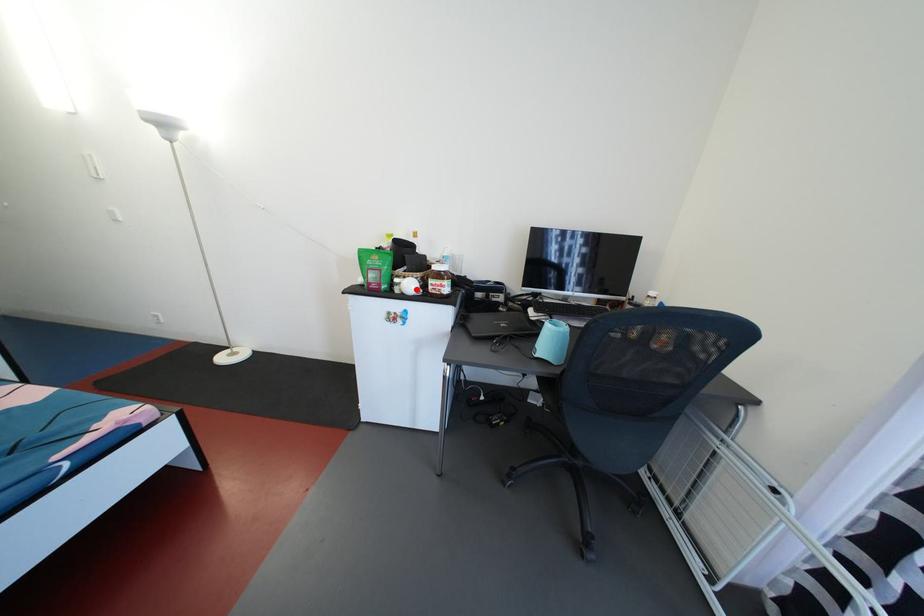
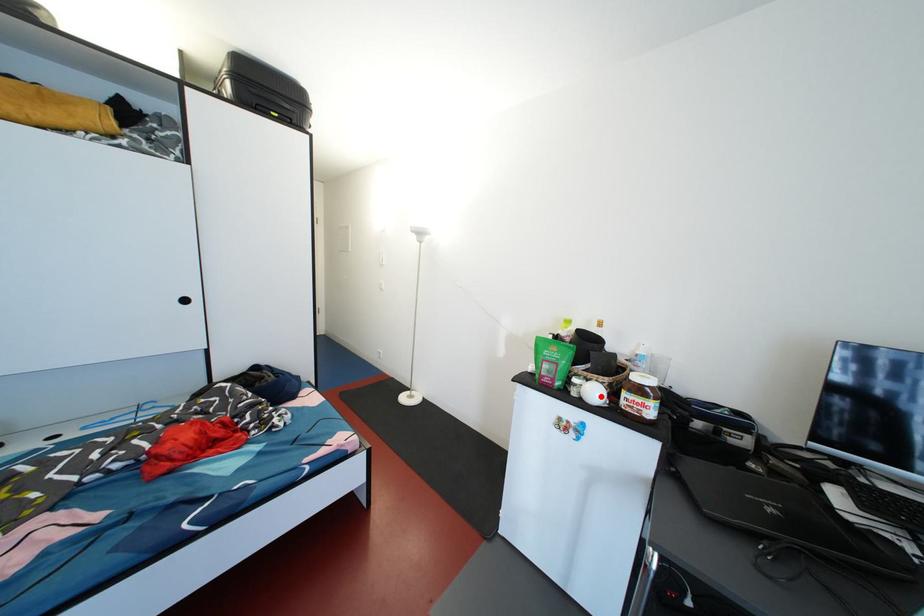
I am providing you with two images of the same scene from different viewpoints. A red point is marked on the first image and another point is marked on the second image. Is the red point in image1 aligned with the point shown in image2?

Yes